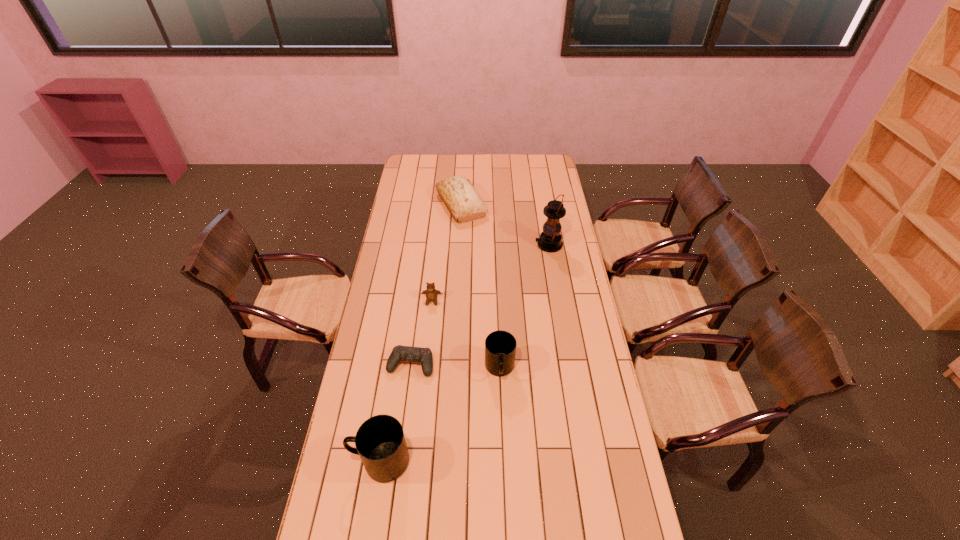
The height and width of the screenshot is (540, 960). I want to click on vacant space that is in between the fourth nearest object and the farthest object, so click(446, 253).

Where is `free space between the nearest object and the farthest object`? This screenshot has width=960, height=540. free space between the nearest object and the farthest object is located at coordinates (420, 333).

Where is `free area in between the nearest object and the farthest object`? The height and width of the screenshot is (540, 960). free area in between the nearest object and the farthest object is located at coordinates (420, 333).

At what (x,y) coordinates should I click in order to perform the action: click on free spot between the fifth shortest object and the second shortest object. Please return your answer as a coordinate pair (x, y). This screenshot has height=540, width=960. Looking at the image, I should click on (406, 381).

The height and width of the screenshot is (540, 960). I want to click on free area in between the right mug and the lantern, so click(524, 307).

Locate which object ranks third in proximity to the farthest object. Please provide its 2D coordinates. Your answer should be formatted as a tuple, i.e. [(x, y)], where the tuple contains the x and y coordinates of a point satisfying the conditions above.

[(399, 353)]

This screenshot has width=960, height=540. I want to click on object that is the closest to the control, so click(500, 346).

This screenshot has height=540, width=960. Identify the location of free location that satisfies the following two spatial constraints: 1. on the side of the right mug with the handle; 2. on the side of the taller mug with the handle. (503, 461).

Identify the location of free region that satisfies the following two spatial constraints: 1. on the side of the shorter mug with the handle; 2. on the side of the fifth shortest object with the handle. This screenshot has height=540, width=960. [x=503, y=461].

Locate an element on the screen. The image size is (960, 540). vacant space that satisfies the following two spatial constraints: 1. at the face of the teddy bear; 2. on the side of the left mug with the handle is located at coordinates (416, 461).